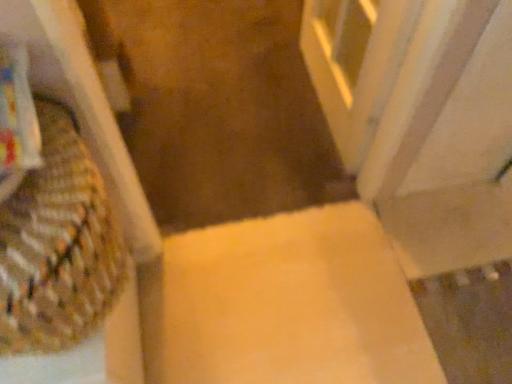
Question: Is the depth of matte yellow cardboard box at center greater than that of woven fabric basket at left?

Choices:
 (A) yes
 (B) no

Answer: (A)

Question: Is matte yellow cardboard box at center completely or partially outside of woven fabric basket at left?

Choices:
 (A) no
 (B) yes

Answer: (B)

Question: Is matte yellow cardboard box at center facing towards woven fabric basket at left?

Choices:
 (A) no
 (B) yes

Answer: (A)

Question: Considering the relative positions of matte yellow cardboard box at center and woven fabric basket at left in the image provided, is matte yellow cardboard box at center in front of woven fabric basket at left?

Choices:
 (A) no
 (B) yes

Answer: (A)

Question: From the image's perspective, does matte yellow cardboard box at center appear lower than woven fabric basket at left?

Choices:
 (A) yes
 (B) no

Answer: (A)

Question: From a real-world perspective, relative to white marble screen door at upper right, is yellow carpet at center vertically above or below?

Choices:
 (A) below
 (B) above

Answer: (A)

Question: From the image's perspective, is yellow carpet at center above or below white marble screen door at upper right?

Choices:
 (A) below
 (B) above

Answer: (A)

Question: Does point (206, 124) appear closer or farther from the camera than point (317, 18)?

Choices:
 (A) closer
 (B) farther

Answer: (A)

Question: Is yellow carpet at center taller or shorter than white marble screen door at upper right?

Choices:
 (A) tall
 (B) short

Answer: (B)

Question: Is woven fabric basket at left to the left or to the right of matte yellow cardboard box at center in the image?

Choices:
 (A) right
 (B) left

Answer: (B)

Question: Considering their positions, is woven fabric basket at left located in front of or behind matte yellow cardboard box at center?

Choices:
 (A) behind
 (B) front

Answer: (B)

Question: Looking at the image, does woven fabric basket at left seem bigger or smaller compared to matte yellow cardboard box at center?

Choices:
 (A) small
 (B) big

Answer: (A)

Question: In terms of height, does woven fabric basket at left look taller or shorter compared to matte yellow cardboard box at center?

Choices:
 (A) short
 (B) tall

Answer: (B)

Question: Is white marble screen door at upper right in front of or behind matte yellow cardboard box at center in the image?

Choices:
 (A) front
 (B) behind

Answer: (A)

Question: Does point (325, 21) appear closer or farther from the camera than point (376, 337)?

Choices:
 (A) closer
 (B) farther

Answer: (B)